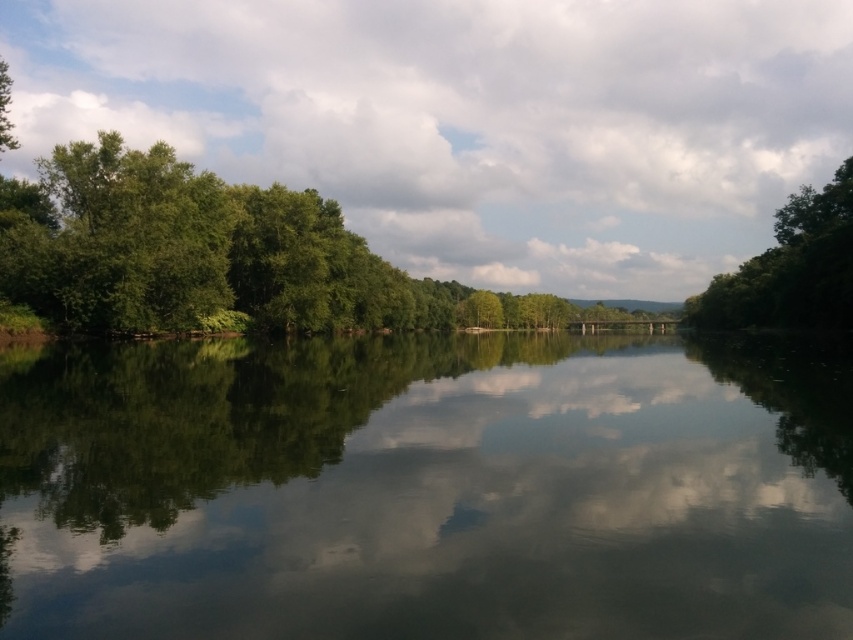
Question: Which point is closer to the camera taking this photo?

Choices:
 (A) (637, 593)
 (B) (828, 240)

Answer: (A)

Question: Among these points, which one is farthest from the camera?

Choices:
 (A) (816, 308)
 (B) (136, 353)

Answer: (A)

Question: Where is green reflective water at center located in relation to green leafy tree at upper center in the image?

Choices:
 (A) above
 (B) below

Answer: (B)

Question: Can you confirm if green reflective water at center is positioned to the right of green leafy tree at upper center?

Choices:
 (A) no
 (B) yes

Answer: (A)

Question: Does green reflective water at center come behind green leafy tree at upper center?

Choices:
 (A) no
 (B) yes

Answer: (A)